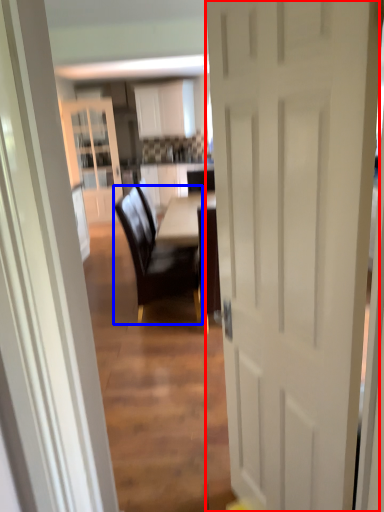
Question: Among these objects, which one is nearest to the camera, door (highlighted by a red box) or chair (highlighted by a blue box)?

Choices:
 (A) door
 (B) chair

Answer: (A)